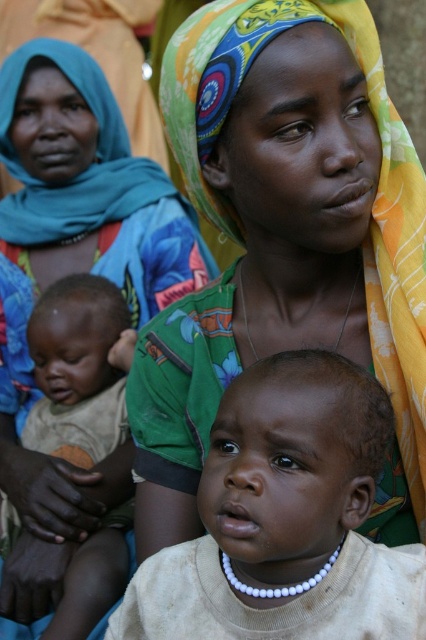
Between matte green scarf at center and light beige fabric at center, which one appears on the left side from the viewer's perspective?

matte green scarf at center is more to the left.

Can you confirm if matte green scarf at center is wider than light beige fabric at center?

Indeed, matte green scarf at center has a greater width compared to light beige fabric at center.

Is point (417, 394) positioned behind point (244, 577)?

Yes, point (417, 394) is behind point (244, 577).

Identify the location of matte green scarf at center. (284, 243).

Does point (285, 365) lie in front of point (94, 397)?

Yes, point (285, 365) is closer to viewer.

At what (x,y) coordinates should I click in order to perform the action: click on light beige fabric at center. Please return your answer as a coordinate pair (x, y). This screenshot has height=640, width=426. Looking at the image, I should click on (285, 518).

Where is `light beige fabric at center`? light beige fabric at center is located at coordinates (285, 518).

Which is more to the left, matte green scarf at center or light brown skin baby at center?

light brown skin baby at center

Does matte green scarf at center have a lesser height compared to light brown skin baby at center?

No, matte green scarf at center is not shorter than light brown skin baby at center.

Who is more distant from viewer, [195,346] or [85,282]?

Positioned behind is point [85,282].

At what (x,y) coordinates should I click in order to perform the action: click on matte green scarf at center. Please return your answer as a coordinate pair (x, y). The height and width of the screenshot is (640, 426). Looking at the image, I should click on (284, 243).